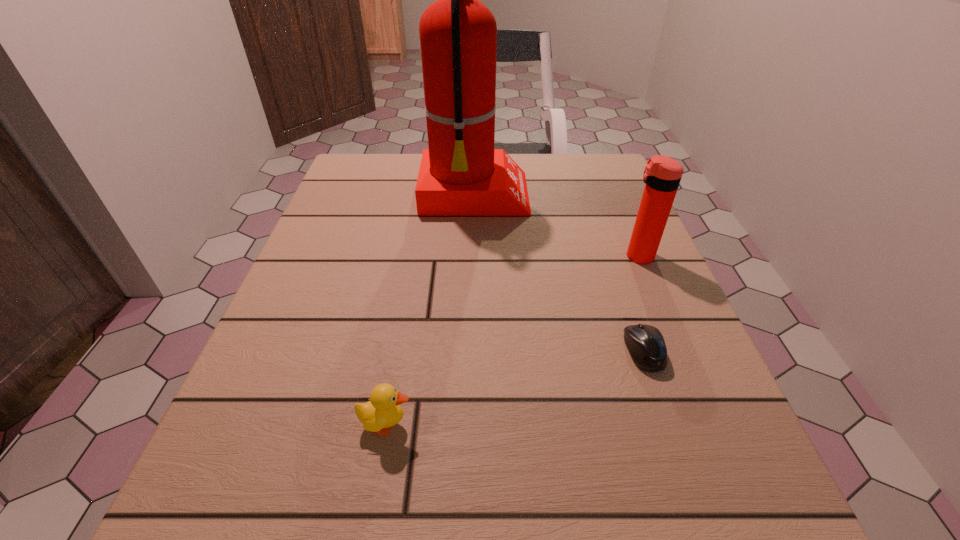
Locate an element on the screen. free space between the mouse and the fire extinguisher is located at coordinates (560, 273).

Locate an element on the screen. vacant area that lies between the fire extinguisher and the nearest object is located at coordinates (431, 310).

Find the location of a particular element. free space that is in between the second tallest object and the farthest object is located at coordinates (557, 226).

I want to click on object that ranks as the third closest to the third farthest object, so click(383, 410).

At what (x,y) coordinates should I click in order to perform the action: click on object that is the third closest to the third shortest object. Please return your answer as a coordinate pair (x, y). The image size is (960, 540). Looking at the image, I should click on (383, 410).

Where is `free space that satisfies the following two spatial constraints: 1. on the front-facing side of the thermos bottle; 2. on the left side of the tallest object`? The width and height of the screenshot is (960, 540). free space that satisfies the following two spatial constraints: 1. on the front-facing side of the thermos bottle; 2. on the left side of the tallest object is located at coordinates (474, 256).

You are a GUI agent. You are given a task and a screenshot of the screen. Output one action in this format:
    pyautogui.click(x=<x>, y=<y>)
    Task: Click on the blank space that satisfies the following two spatial constraints: 1. on the front-facing side of the farthest object; 2. on the back side of the third nearest object
    This screenshot has width=960, height=540.
    Given the screenshot: What is the action you would take?
    pyautogui.click(x=474, y=256)

This screenshot has width=960, height=540. I want to click on vacant space that satisfies the following two spatial constraints: 1. on the back side of the second nearest object; 2. on the front-facing side of the tallest object, so click(x=590, y=196).

Identify the location of free spot that satisfies the following two spatial constraints: 1. on the front-facing side of the fire extinguisher; 2. on the left side of the second nearest object. (472, 351).

Where is `vacant space that satisfies the following two spatial constraints: 1. on the front-facing side of the second farthest object; 2. on the right side of the farthest object`? This screenshot has width=960, height=540. vacant space that satisfies the following two spatial constraints: 1. on the front-facing side of the second farthest object; 2. on the right side of the farthest object is located at coordinates (474, 256).